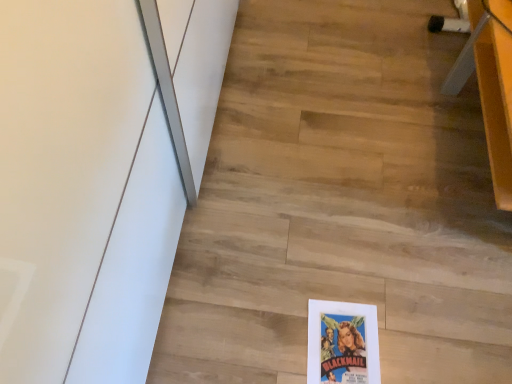
Question: Does wooden floor at center have a lesser height compared to wooden desk at upper right?

Choices:
 (A) yes
 (B) no

Answer: (A)

Question: From a real-world perspective, is wooden floor at center on top of wooden desk at upper right?

Choices:
 (A) yes
 (B) no

Answer: (B)

Question: Could you tell me if wooden floor at center is turned towards wooden desk at upper right?

Choices:
 (A) yes
 (B) no

Answer: (B)

Question: Is wooden floor at center positioned behind wooden desk at upper right?

Choices:
 (A) yes
 (B) no

Answer: (A)

Question: Does wooden floor at center have a greater height compared to wooden desk at upper right?

Choices:
 (A) no
 (B) yes

Answer: (A)

Question: Considering the relative positions of wooden floor at center and wooden desk at upper right in the image provided, is wooden floor at center to the right of wooden desk at upper right from the viewer's perspective?

Choices:
 (A) no
 (B) yes

Answer: (A)

Question: From the image's perspective, is wooden desk at upper right above wooden floor at center?

Choices:
 (A) no
 (B) yes

Answer: (B)

Question: Is wooden desk at upper right further to camera compared to wooden floor at center?

Choices:
 (A) no
 (B) yes

Answer: (A)

Question: From the image's perspective, would you say wooden desk at upper right is shown under wooden floor at center?

Choices:
 (A) no
 (B) yes

Answer: (A)

Question: Considering the relative positions of wooden desk at upper right and wooden floor at center in the image provided, is wooden desk at upper right in front of wooden floor at center?

Choices:
 (A) no
 (B) yes

Answer: (B)

Question: Could you tell me if wooden desk at upper right is turned towards wooden floor at center?

Choices:
 (A) yes
 (B) no

Answer: (A)

Question: Could wooden floor at center be considered to be inside wooden desk at upper right?

Choices:
 (A) no
 (B) yes

Answer: (A)

Question: Is wooden desk at upper right to the left or to the right of wooden floor at center in the image?

Choices:
 (A) left
 (B) right

Answer: (B)